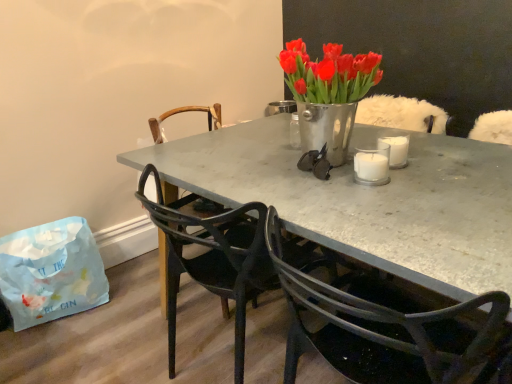
Locate an element on the screen. spots to the right of metallic black glasses at center is located at coordinates (364, 150).